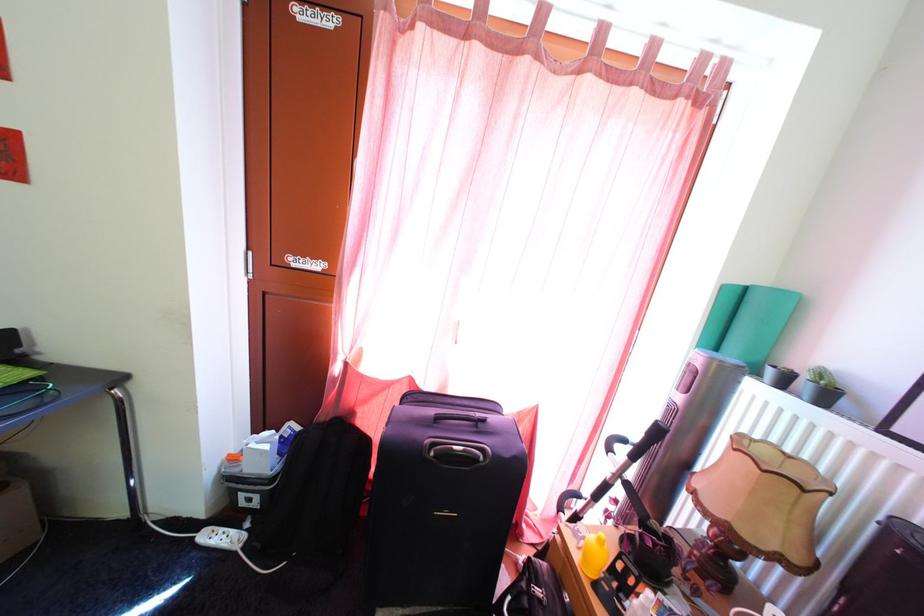
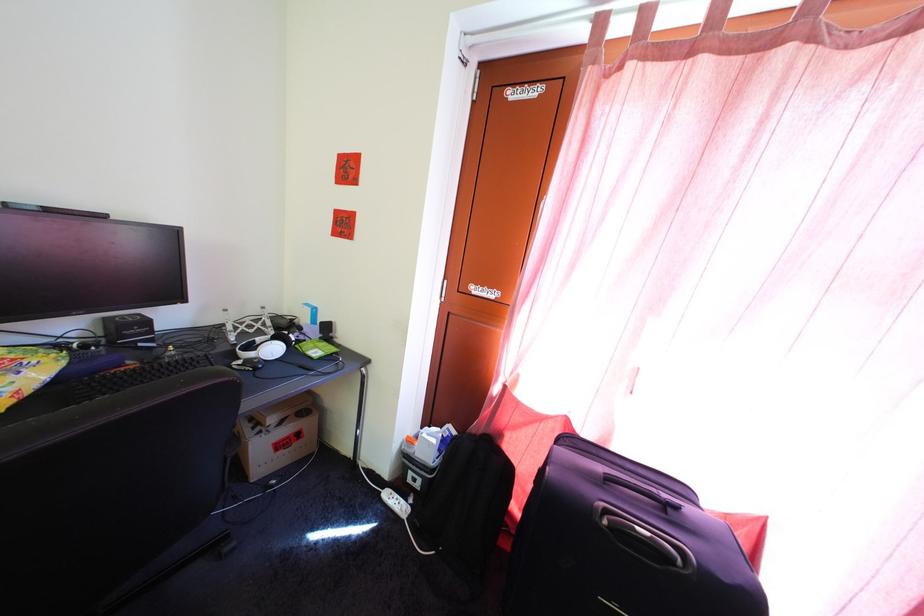
Question: Based on the continuous images, in which direction is the camera rotating? Reply with the corresponding letter.

Choices:
 (A) Left
 (B) Right
 (C) Up
 (D) Down

Answer: (A)